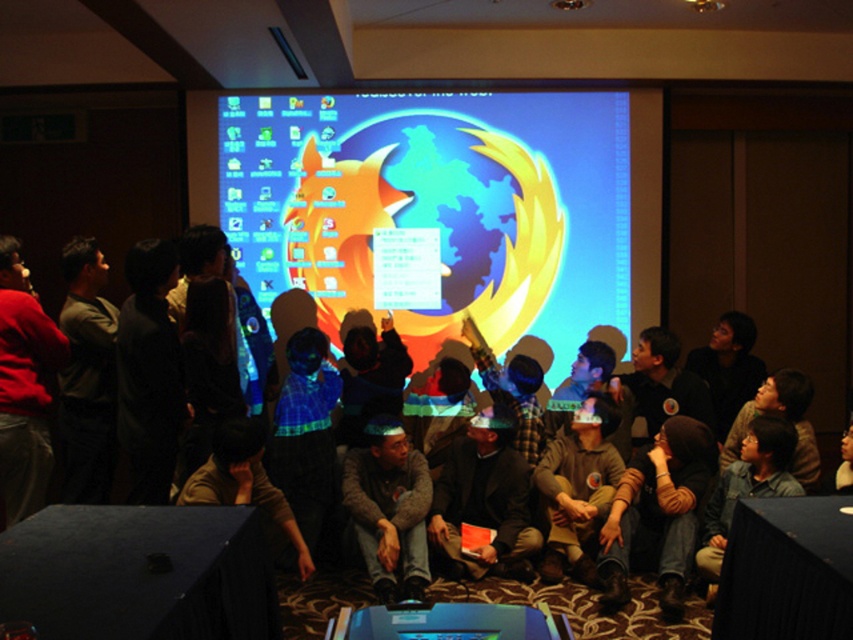
Question: Based on their relative distances, which object is nearer to the dark gray fabric shirt at center?

Choices:
 (A) dark brown leather jacket at center
 (B) matte plastic screen at center
 (C) brown knit hat at center
 (D) brown fabric shirt at center

Answer: (A)

Question: Which point appears farthest from the camera in this image?

Choices:
 (A) (15, 310)
 (B) (537, 531)

Answer: (B)

Question: Is brown fabric shirt at center positioned in front of brown fabric shirt at lower center?

Choices:
 (A) yes
 (B) no

Answer: (B)

Question: Does dark gray sweater at left have a lesser width compared to brown fabric shirt at center?

Choices:
 (A) no
 (B) yes

Answer: (B)

Question: Among these points, which one is nearest to the camera?

Choices:
 (A) (412, 560)
 (B) (621, 209)
 (C) (64, 268)

Answer: (C)

Question: Can you confirm if dark brown leather jacket at center is positioned below brown fabric shirt at center?

Choices:
 (A) no
 (B) yes

Answer: (B)